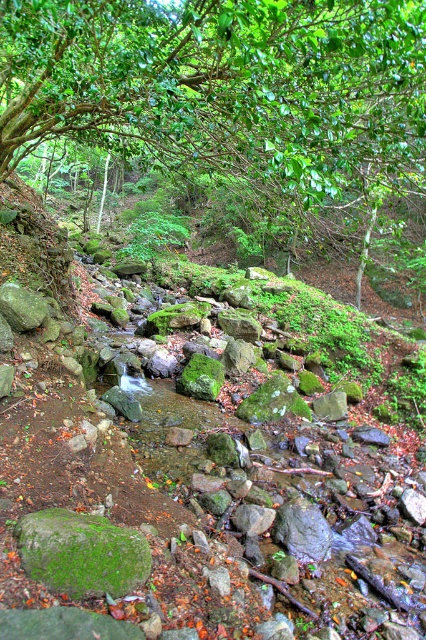
You are a hiker who wants to cross the stream without getting your boots wet. You see the green leafy tree at upper center and the green mossy rock at center. Which object should you avoid stepping on to stay dry?

You should avoid stepping on the green mossy rock at center because it is in the stream bed, while the green leafy tree at upper center is positioned over it and likely out of the water flow.

You are a hiker trying to determine the best spot to cross the stream. You notice the green leafy tree at upper center and the green mossy rock at center. Which object is shorter and therefore easier to step over while crossing?

The green leafy tree at upper center is not as tall as the green mossy rock at center, so it is shorter and easier to step over while crossing.